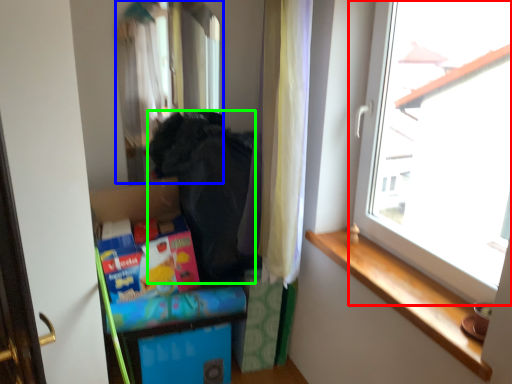
Question: Which is nearer to the window (highlighted by a red box)? mirror (highlighted by a blue box) or clothing (highlighted by a green box).

Choices:
 (A) mirror
 (B) clothing

Answer: (B)